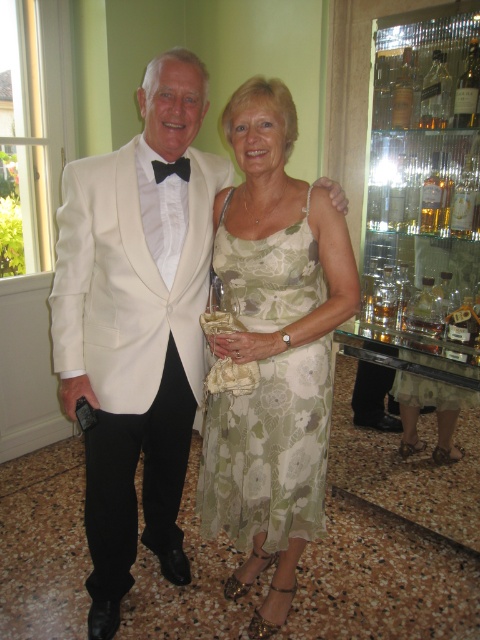
Question: Among these points, which one is nearest to the camera?

Choices:
 (A) (159, 352)
 (B) (321, 268)

Answer: (A)

Question: Does white satin tuxedo at center have a larger size compared to green floral fabric dress at center?

Choices:
 (A) no
 (B) yes

Answer: (B)

Question: Which point is closer to the camera?

Choices:
 (A) (144, 77)
 (B) (244, 506)

Answer: (A)

Question: Is white satin tuxedo at center wider than green floral fabric dress at center?

Choices:
 (A) yes
 (B) no

Answer: (A)

Question: Is white satin tuxedo at center further to the viewer compared to green floral fabric dress at center?

Choices:
 (A) yes
 (B) no

Answer: (B)